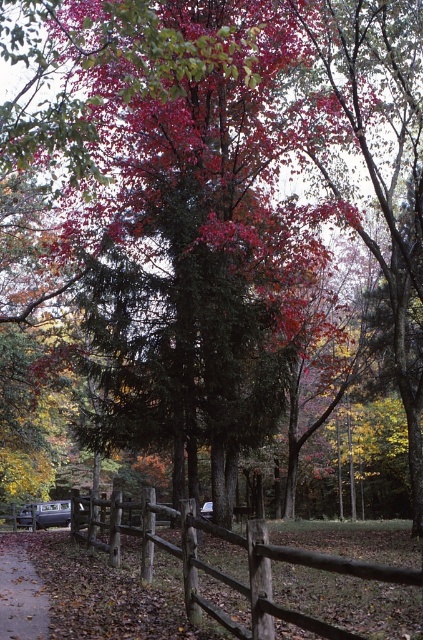
Question: Which of the following is the closest to the observer?

Choices:
 (A) brown wooden path at lower left
 (B) metallic silver car at lower left

Answer: (A)

Question: Is the position of brown wooden fence at lower center more distant than that of brown wooden path at lower left?

Choices:
 (A) yes
 (B) no

Answer: (B)

Question: Based on their relative distances, which object is farther from the brown wooden path at lower left?

Choices:
 (A) brown wooden fence at lower center
 (B) metallic silver car at lower left

Answer: (B)

Question: Is brown wooden fence at lower center above brown wooden path at lower left?

Choices:
 (A) no
 (B) yes

Answer: (B)

Question: Does brown wooden fence at lower center appear over brown wooden path at lower left?

Choices:
 (A) yes
 (B) no

Answer: (A)

Question: Among these objects, which one is nearest to the camera?

Choices:
 (A) metallic silver car at lower left
 (B) brown wooden fence at lower center

Answer: (B)